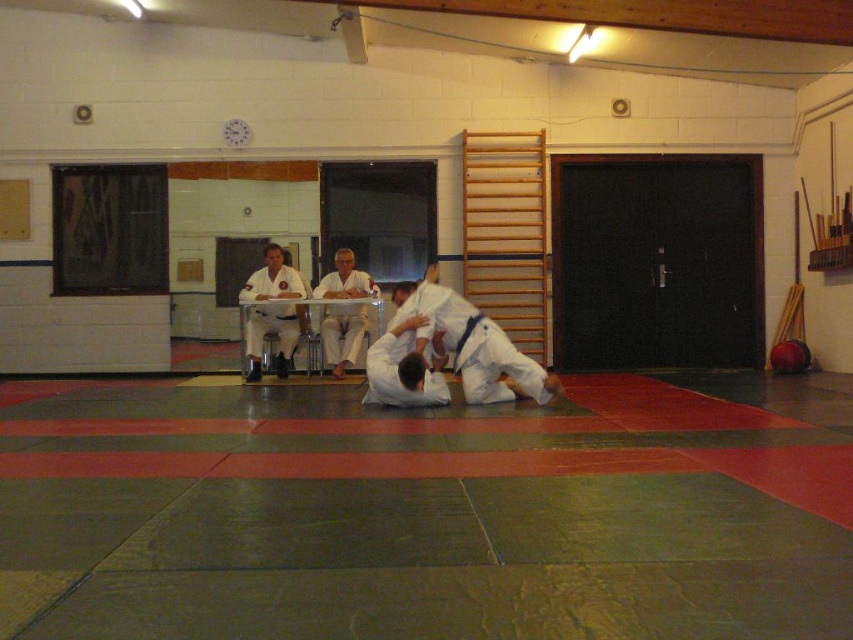
You are a martial arts instructor preparing to distribute practice mats. You notice the white karate gi at center and the white fabric pants at center. Which item requires more space to store properly?

The white karate gi at center is larger in size than the white fabric pants at center, so it requires more storage space.

You are standing in the dojo and want to place a new equipment rack at the point marked as point (520, 388). The rack requires a space that is at least 25 feet away from the current training area to avoid interference. Is the point far enough?

The point (520, 388) is 24.95 feet from the viewer, which is slightly less than the required 25 feet. Therefore, the equipment rack may interfere with the training area and should be placed further back.

You are a photographer taking a picture of the judo practice. You want to focus on the white karate uniform at center and the white fabric pants at center. Which one should you adjust your camera to the left to capture better?

The white karate uniform at center is positioned on the left side of white fabric pants at center, so to better capture the white karate uniform at center, adjust your camera to the left.